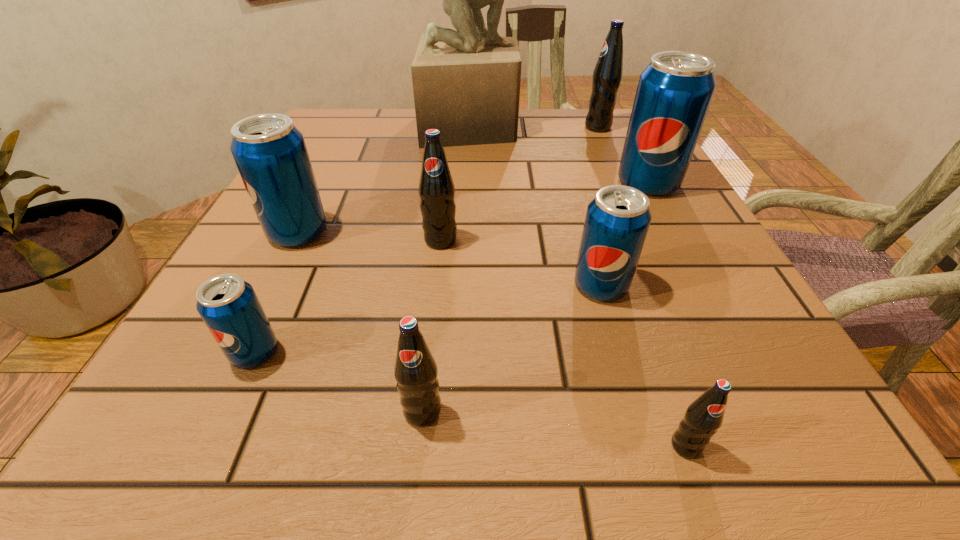
The image size is (960, 540). I want to click on the tallest object, so click(x=466, y=83).

Find the location of a particular element. This screenshot has width=960, height=540. gray sculpture is located at coordinates (466, 83).

Locate an element on the screen. The image size is (960, 540). the rightmost blue pop soda is located at coordinates (674, 93).

The image size is (960, 540). In order to click on the seventh nearest object in this screenshot , I will do `click(674, 93)`.

Locate an element on the screen. The image size is (960, 540). the farthest black pop is located at coordinates 607,75.

Where is `the rightmost black pop`? This screenshot has width=960, height=540. the rightmost black pop is located at coordinates (607, 75).

Locate an element on the screen. The width and height of the screenshot is (960, 540). the third nearest black pop is located at coordinates (436, 187).

You are a GUI agent. You are given a task and a screenshot of the screen. Output one action in this format:
    pyautogui.click(x=<x>, y=<y>)
    Task: Click on the second biggest blue pop soda
    
    Given the screenshot: What is the action you would take?
    pyautogui.click(x=270, y=153)

At what (x,y) coordinates should I click in order to perform the action: click on the third blue pop soda from left to right. Please return your answer as a coordinate pair (x, y). Looking at the image, I should click on (617, 220).

Image resolution: width=960 pixels, height=540 pixels. I want to click on the third farthest blue pop soda, so click(x=617, y=220).